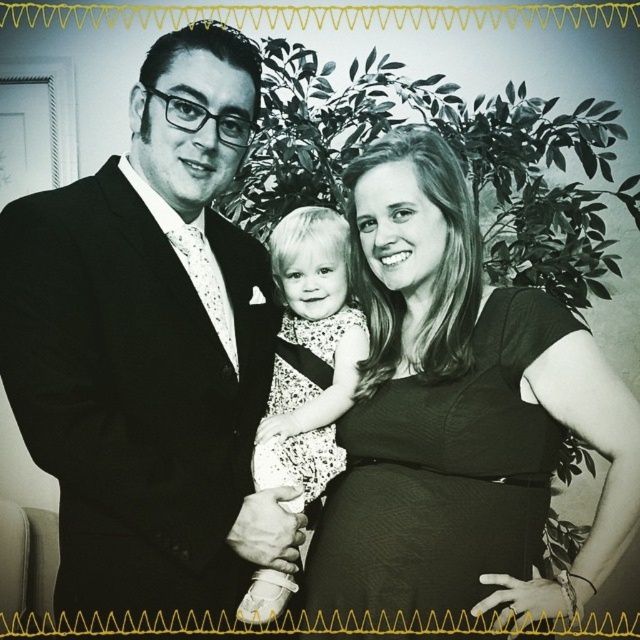
Question: Is smooth black dress at center thinner than white dotted dress at center?

Choices:
 (A) no
 (B) yes

Answer: (A)

Question: Is black satin suit at left above white dotted dress at center?

Choices:
 (A) yes
 (B) no

Answer: (A)

Question: From the image, what is the correct spatial relationship of black satin suit at left in relation to white dotted dress at center?

Choices:
 (A) right
 (B) left

Answer: (B)

Question: Among these points, which one is farthest from the camera?

Choices:
 (A) (228, 484)
 (B) (538, 364)
 (C) (259, 474)

Answer: (C)

Question: Which of the following is the farthest from the observer?

Choices:
 (A) black satin suit at left
 (B) white dotted dress at center

Answer: (B)

Question: Which object is farther from the camera taking this photo?

Choices:
 (A) smooth black dress at center
 (B) white dotted dress at center
 (C) black satin suit at left

Answer: (B)